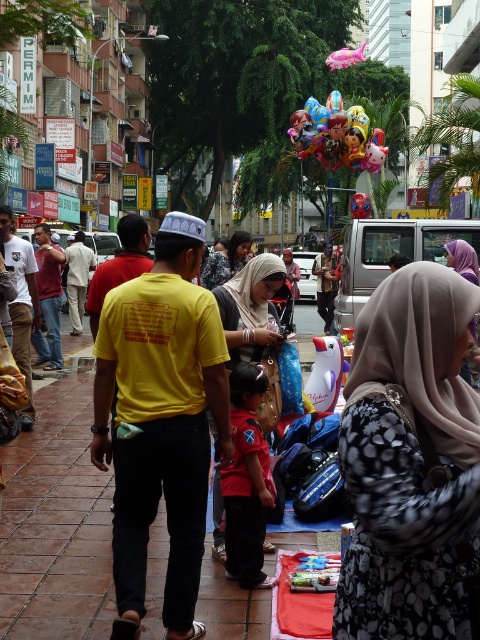
You are a photographer trying to capture a shot of the glossy metallic balloons at center and the translucent plastic balloon at center. Which balloon should you focus on first if you want to include both in your frame without moving the camera?

The glossy metallic balloons at center should be focused on first because they are located above the translucent plastic balloon at center, so adjusting the focus to the upper part will ensure both are in the frame.